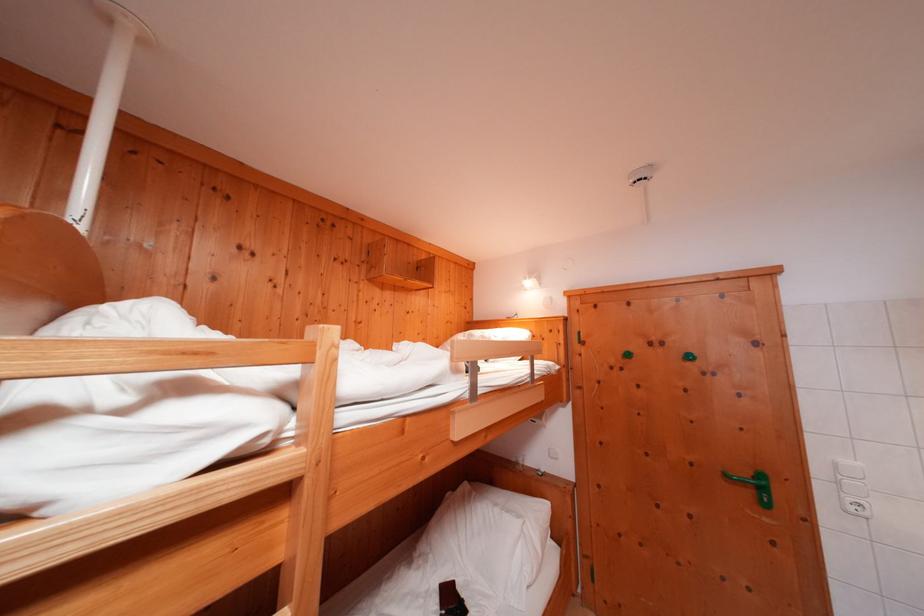
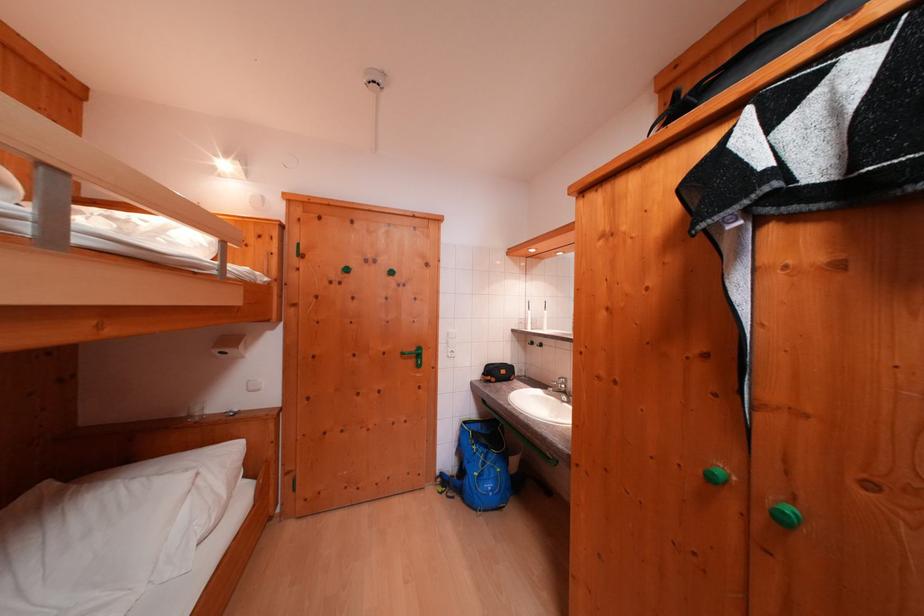
Question: The camera is either moving clockwise (left) or counter-clockwise (right) around the object. The first image is from the beginning of the video and the second image is from the end. Is the camera moving left or right when shooting the video?

Choices:
 (A) Left
 (B) Right

Answer: (A)